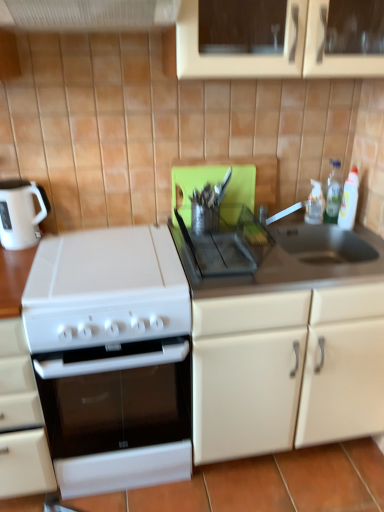
Question: Is white glossy gas stove at left, the second gas stove positioned from the top, bigger than clear plastic bottle at upper right, which ranks as the 2th bottle in right-to-left order?

Choices:
 (A) yes
 (B) no

Answer: (A)

Question: Can you confirm if white glossy gas stove at left, the first gas stove when ordered from left to right, is taller than clear plastic bottle at upper right, the first bottle when ordered from left to right?

Choices:
 (A) yes
 (B) no

Answer: (A)

Question: From the image's perspective, is white glossy gas stove at left, the second gas stove positioned from the top, below clear plastic bottle at upper right, the first bottle when ordered from left to right?

Choices:
 (A) no
 (B) yes

Answer: (B)

Question: Is white glossy gas stove at left, which ranks as the 2th gas stove in right-to-left order, closer to the viewer compared to clear plastic bottle at upper right, the first bottle when ordered from left to right?

Choices:
 (A) yes
 (B) no

Answer: (A)

Question: From the image's perspective, is white glossy gas stove at left, which ranks as the first gas stove in bottom-to-top order, located above clear plastic bottle at upper right, the first bottle when ordered from left to right?

Choices:
 (A) yes
 (B) no

Answer: (B)

Question: Is white glossy gas stove at left, the second gas stove positioned from the top, to the left or to the right of clear plastic bottle at upper right, the first bottle when ordered from left to right, in the image?

Choices:
 (A) right
 (B) left

Answer: (B)

Question: From the image's perspective, is white glossy gas stove at left, the first gas stove when ordered from left to right, positioned above or below clear plastic bottle at upper right, the first bottle when ordered from left to right?

Choices:
 (A) above
 (B) below

Answer: (B)

Question: Considering the positions of point (114, 263) and point (319, 202), is point (114, 263) closer or farther from the camera than point (319, 202)?

Choices:
 (A) farther
 (B) closer

Answer: (B)

Question: From their relative heights in the image, would you say white glossy gas stove at left, which ranks as the 2th gas stove in right-to-left order, is taller or shorter than clear plastic bottle at upper right, the first bottle when ordered from left to right?

Choices:
 (A) short
 (B) tall

Answer: (B)

Question: In terms of height, does white plastic exhaust hood at upper center look taller or shorter compared to white glossy gas stove at left, the second gas stove positioned from the top?

Choices:
 (A) tall
 (B) short

Answer: (B)

Question: From a real-world perspective, is white plastic exhaust hood at upper center physically located above or below white glossy gas stove at left, the first gas stove when ordered from left to right?

Choices:
 (A) above
 (B) below

Answer: (A)

Question: Is point (23, 3) closer or farther from the camera than point (185, 468)?

Choices:
 (A) farther
 (B) closer

Answer: (B)

Question: Is white plastic exhaust hood at upper center in front of or behind white glossy gas stove at left, which ranks as the first gas stove in bottom-to-top order, in the image?

Choices:
 (A) behind
 (B) front

Answer: (B)

Question: In the image, is white matte oven at lower left, the 2th cabinetry when ordered from right to left, positioned in front of or behind white matte cabinet at right, marked as the 2th cabinetry in a left-to-right arrangement?

Choices:
 (A) front
 (B) behind

Answer: (A)

Question: Considering the positions of white matte oven at lower left, the 1th cabinetry viewed from the left, and white matte cabinet at right, positioned as the 1th cabinetry in right-to-left order, in the image, is white matte oven at lower left, the 1th cabinetry viewed from the left, taller or shorter than white matte cabinet at right, positioned as the 1th cabinetry in right-to-left order,?

Choices:
 (A) short
 (B) tall

Answer: (A)